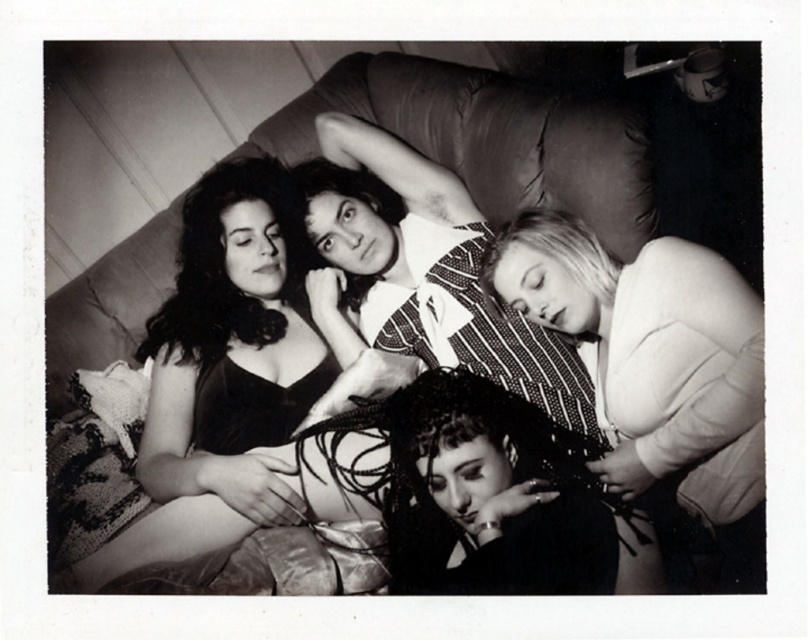
Who is higher up, matte black dress at upper left or leather couch at center?

Positioned higher is leather couch at center.

Measure the distance between point (x=251, y=163) and camera.

Point (x=251, y=163) is 1.72 meters from camera.

Which is in front, point (276, 406) or point (512, 97)?

Positioned in front is point (276, 406).

Where is `matte black dress at upper left`? This screenshot has width=808, height=640. matte black dress at upper left is located at coordinates (213, 384).

Does matte black dress at upper left lie in front of striped fabric shirt at center?

That is True.

Which is behind, point (229, 316) or point (310, 300)?

The point (229, 316) is behind.

Which is behind, point (99, 577) or point (426, 362)?

Point (426, 362)

Where is `matte black dress at upper left`? matte black dress at upper left is located at coordinates (213, 384).

Does white fluffy coat at lower right appear under leather couch at center?

Correct, white fluffy coat at lower right is located below leather couch at center.

Who is more forward, (705, 371) or (116, 252)?

Point (705, 371) is more forward.

Locate an element on the screen. The width and height of the screenshot is (808, 640). white fluffy coat at lower right is located at coordinates (642, 342).